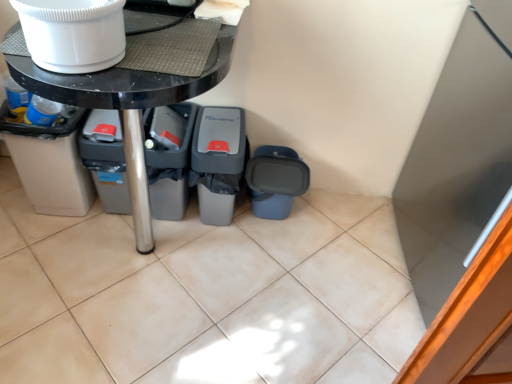
Where is `vacant area that lies between white glossy refrigerator at upper right and gray plastic recycling bin at center, placed as the second recycling bin when sorted from left to right`? The width and height of the screenshot is (512, 384). vacant area that lies between white glossy refrigerator at upper right and gray plastic recycling bin at center, placed as the second recycling bin when sorted from left to right is located at coordinates (330, 251).